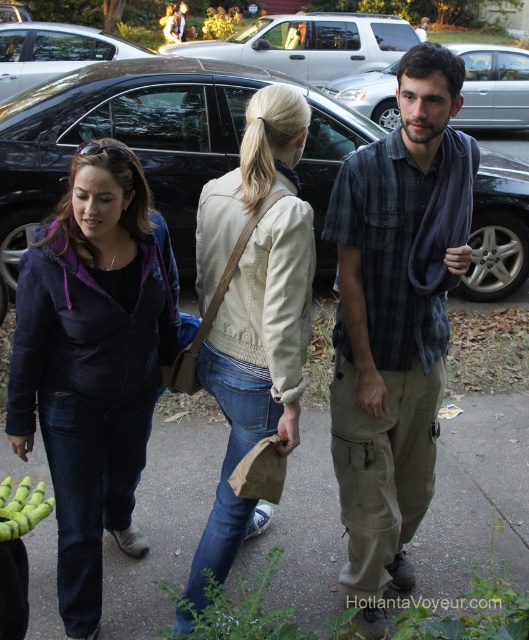
Based on the photo, you are standing at the point marked by the coordinates point (94,362) in the image. Looking around, you see a purple matte jacket at left and a woman in a light beige jacket at center. Which direction should you walk to reach the woman in the light beige jacket at center?

You should walk to the right from the point (94,362) to reach the woman in the light beige jacket at center, as the purple matte jacket at left is located to your left side.

You are a delivery person trying to deliver a package to the address located behind the purple matte jacket at left and the black matte car at center. The delivery truck is 2 meters wide. Can the truck pass between them?

The purple matte jacket at left is thinner than the black matte car at center, but the description does not provide the exact width of the space between them. Therefore, it is unclear if the delivery truck can pass through.